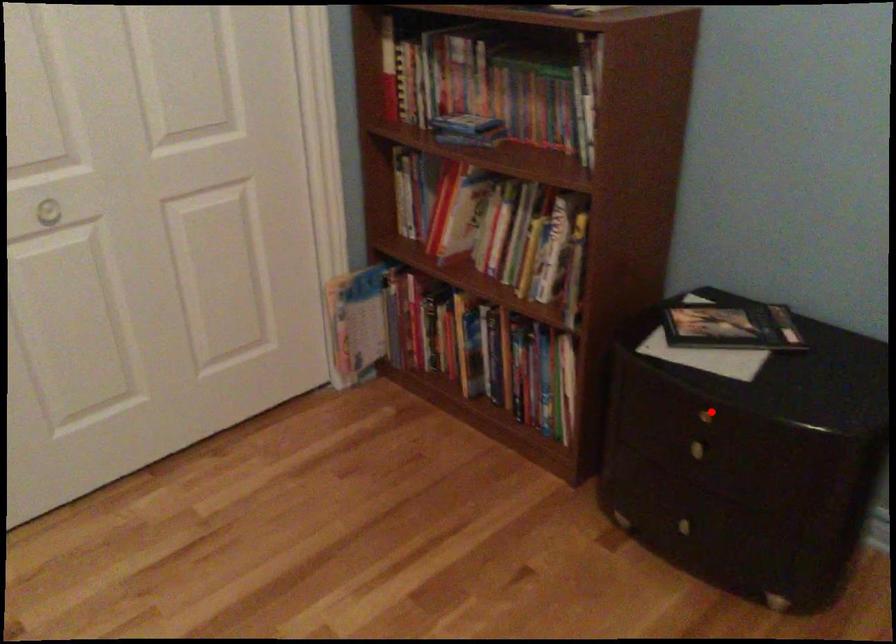
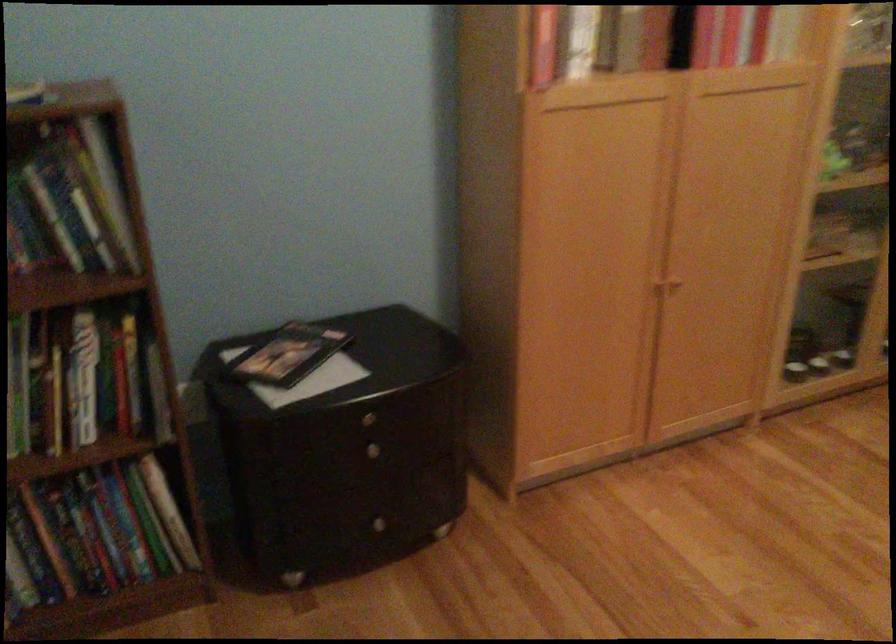
Question: A red point is marked in image1. In image2, is the corresponding 3D point closer to the camera or farther? Reply with the corresponding letter.

Choices:
 (A) The corresponding 3D point is closer.
 (B) The corresponding 3D point is farther.

Answer: (B)